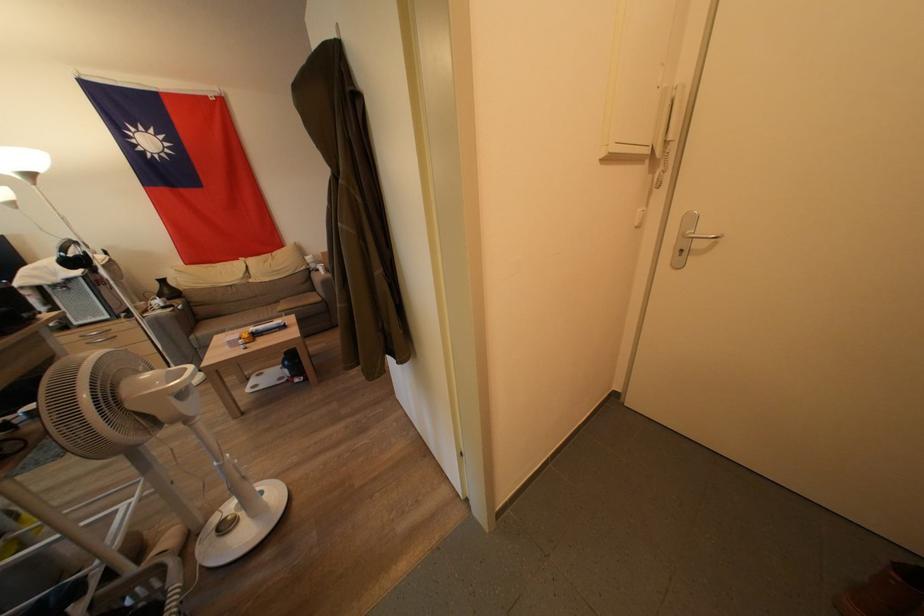
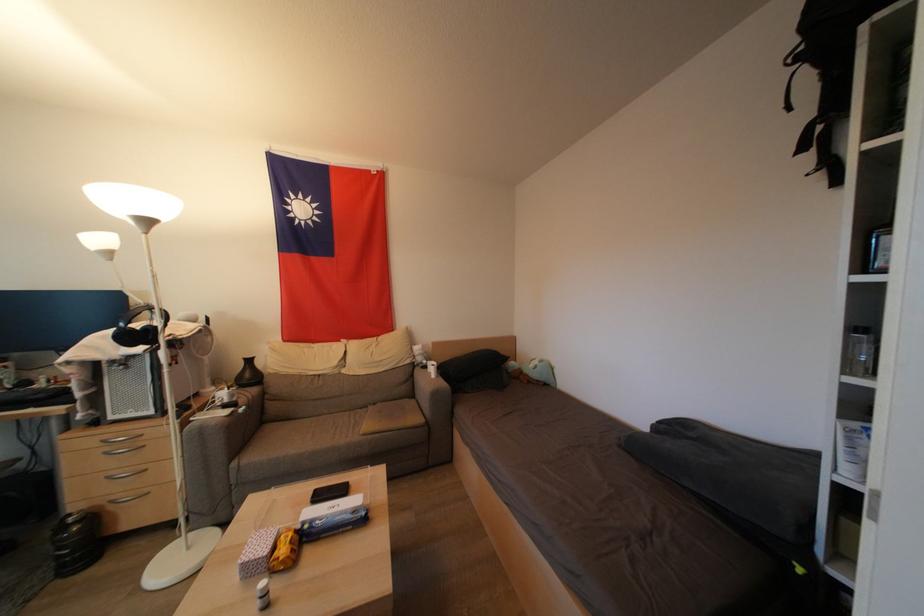
Find the pixel in the second image that matches point (261, 339) in the first image.

(310, 541)